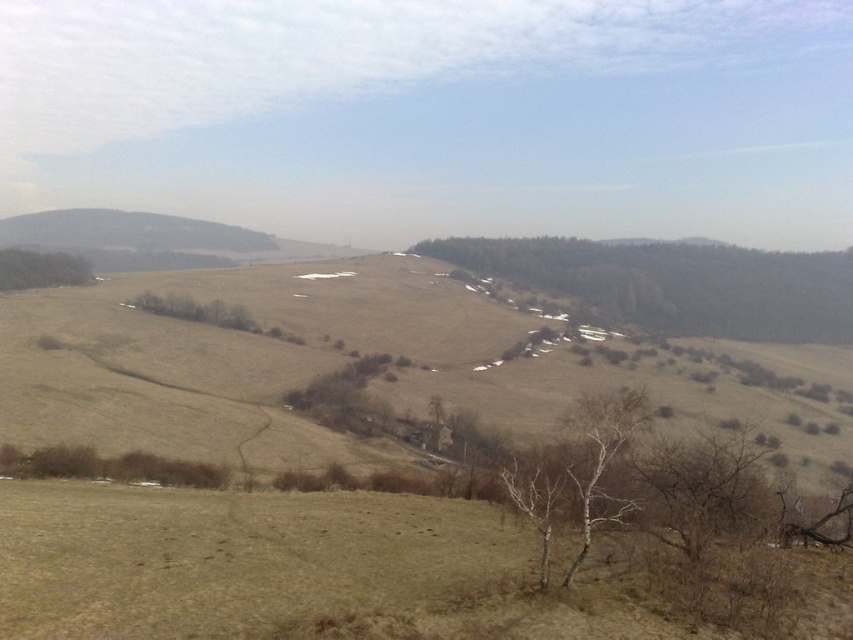
You are a hiker trying to navigate through the hills. You see a brown textured tree at center and a green matte tree at left. Which tree would you use as a landmark if you want to mark a higher elevation point?

The brown textured tree at center is much taller than the green matte tree at left, so it would be a better landmark for a higher elevation point since taller trees often indicate higher ground.

You are standing at the point marked by point (676,284) in the image, which is at the center of the scene. Looking around, you notice a brown textured tree at center. What direction should you face to see the brown textured tree at center?

You are already facing the brown textured tree at center since the point (676,284) marks its location at the center of the scene.